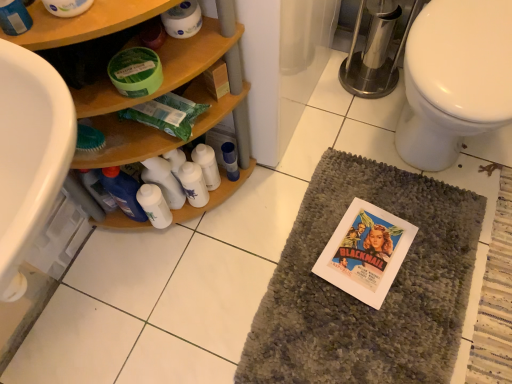
Where is `free region on the left part of gray textured bath mat at center`? Image resolution: width=512 pixels, height=384 pixels. free region on the left part of gray textured bath mat at center is located at coordinates (186, 284).